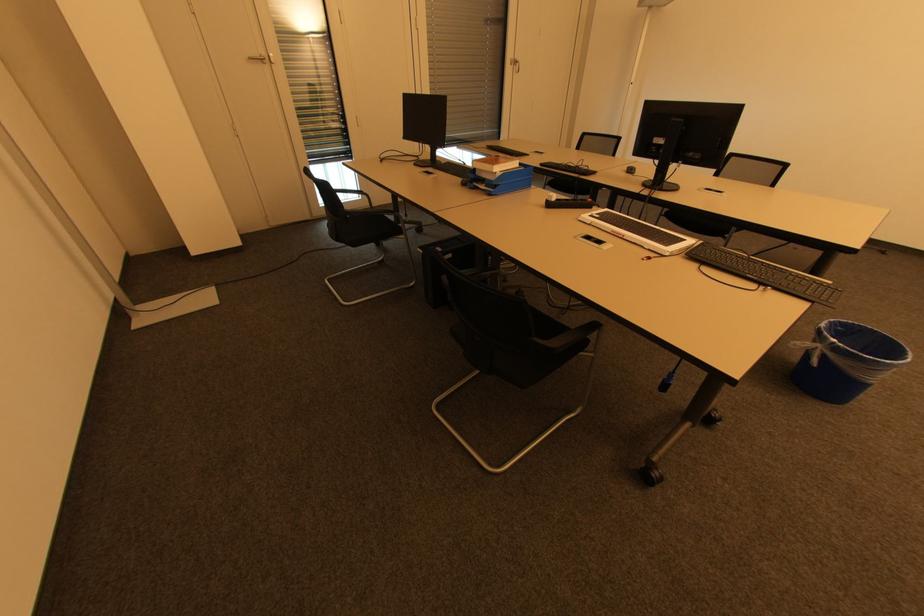
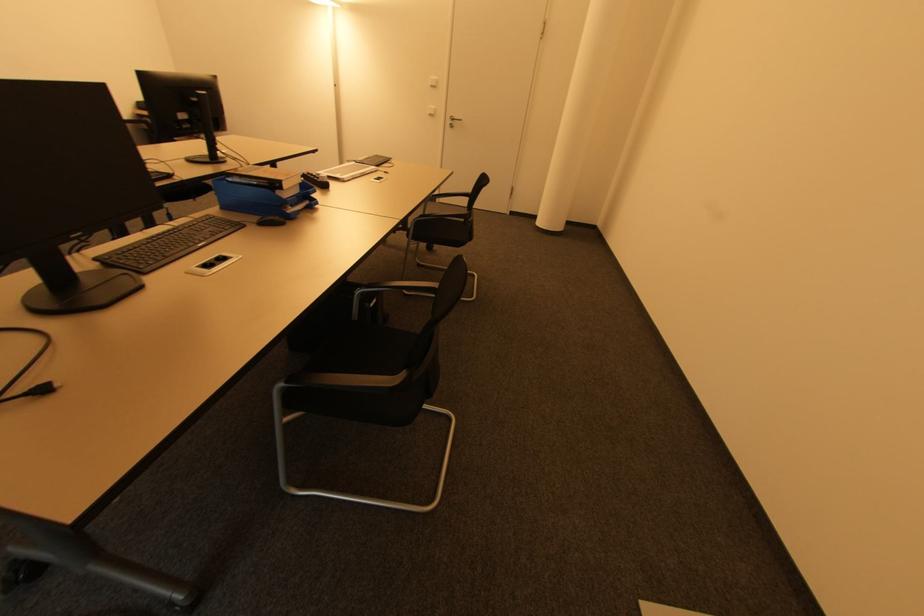
Find the pixel in the second image that matches point 488,187 in the first image.

(294, 207)